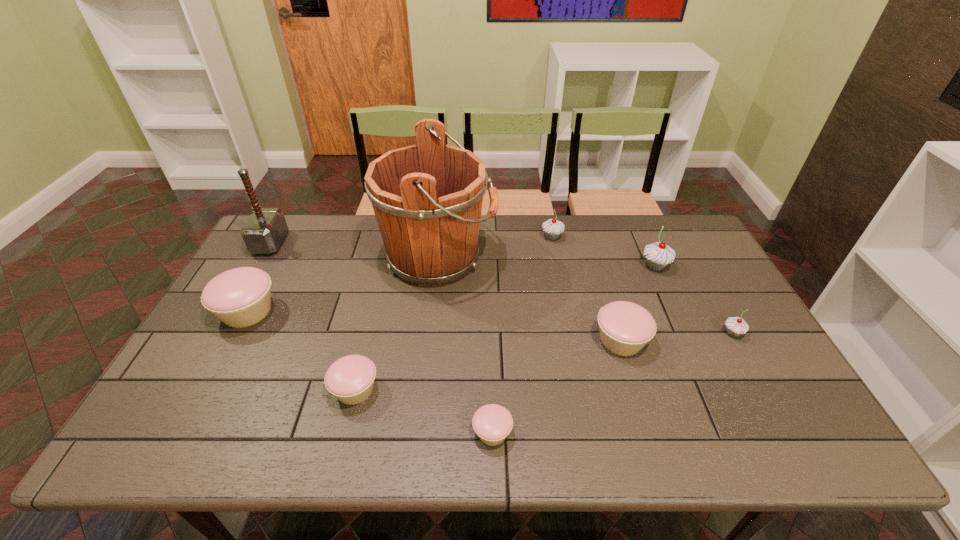
Locate an element on the screen. cupcake that is the fifth closest to the nearest object is located at coordinates (658, 255).

This screenshot has width=960, height=540. Find the location of `cupcake that stands as the fifth closest to the nearest gray cupcake`. cupcake that stands as the fifth closest to the nearest gray cupcake is located at coordinates tap(350, 379).

Locate an element on the screen. The width and height of the screenshot is (960, 540). the closest gray cupcake to the nearest pink cupcake is located at coordinates (736, 326).

Identify which gray cupcake is the third nearest to the third smallest pink cupcake. Please provide its 2D coordinates. Your answer should be formatted as a tuple, i.e. [(x, y)], where the tuple contains the x and y coordinates of a point satisfying the conditions above.

[(553, 228)]

Identify the location of the fourth closest pink cupcake to the brown hammer. (625, 328).

Identify which pink cupcake is the second closest to the tallest object. Please provide its 2D coordinates. Your answer should be formatted as a tuple, i.e. [(x, y)], where the tuple contains the x and y coordinates of a point satisfying the conditions above.

[(240, 297)]

The height and width of the screenshot is (540, 960). I want to click on free point that satisfies the following two spatial constraints: 1. on the front side of the fourth cupcake from left to right; 2. with the handle on the side of the bucket, so click(556, 258).

You are a GUI agent. You are given a task and a screenshot of the screen. Output one action in this format:
    pyautogui.click(x=<x>, y=<y>)
    Task: Click on the free space that satisfies the following two spatial constraints: 1. on the front side of the third object from right to left; 2. on the left side of the sixth object from left to right
    The image size is (960, 540).
    Given the screenshot: What is the action you would take?
    pyautogui.click(x=573, y=340)